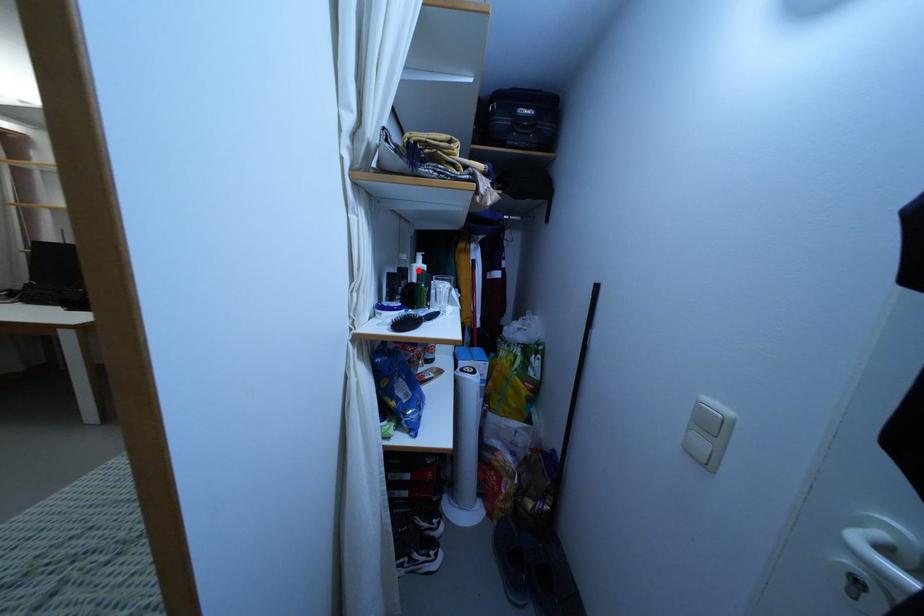
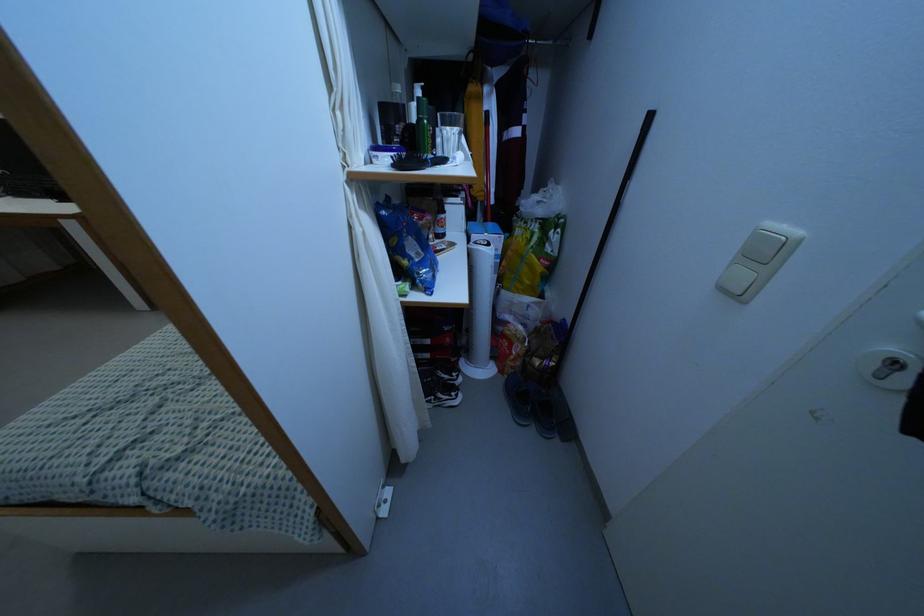
Find the pixel in the second image that matches the highlighted location in the first image.

(418, 98)